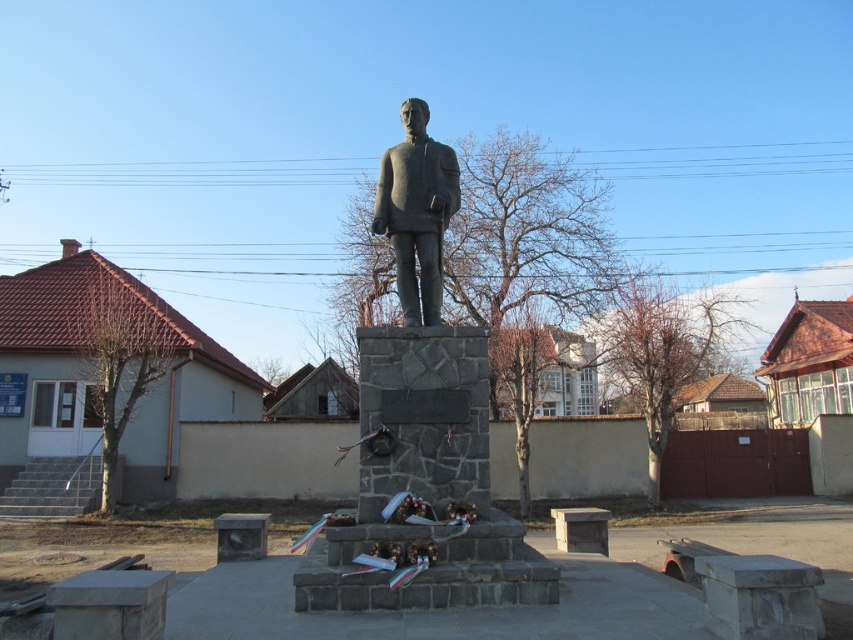
Who is positioned more to the left, polished bronze statue at center or bronze statue at center?

From the viewer's perspective, bronze statue at center appears more on the left side.

Measure the distance between polished bronze statue at center and camera.

The distance of polished bronze statue at center from camera is 22.21 feet.

Which is in front, point (405, 248) or point (421, 208)?

Point (421, 208) is in front.

You are a GUI agent. You are given a task and a screenshot of the screen. Output one action in this format:
    pyautogui.click(x=<x>, y=<y>)
    Task: Click on the polished bronze statue at center
    This screenshot has height=640, width=853.
    Given the screenshot: What is the action you would take?
    pyautogui.click(x=422, y=424)